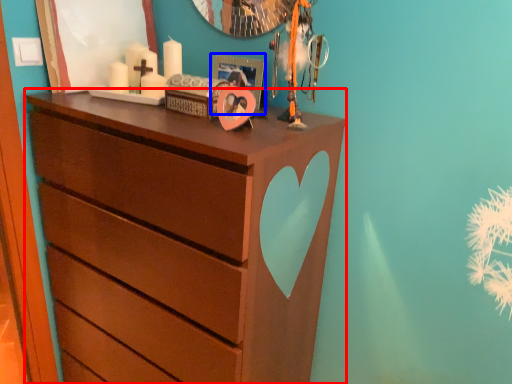
Question: Which of the following is the closest to the observer, chest of drawers (highlighted by a red box) or picture frame (highlighted by a blue box)?

Choices:
 (A) chest of drawers
 (B) picture frame

Answer: (A)